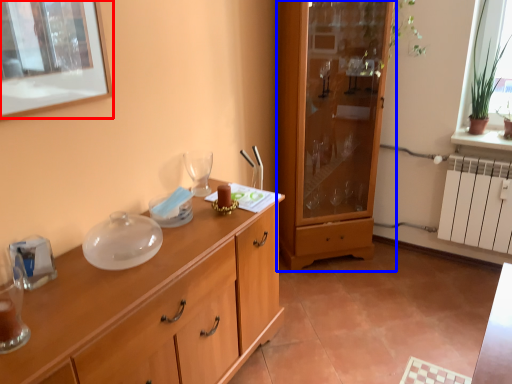
Question: Which object is further to the camera taking this photo, picture frame (highlighted by a red box) or cabinetry (highlighted by a blue box)?

Choices:
 (A) picture frame
 (B) cabinetry

Answer: (B)